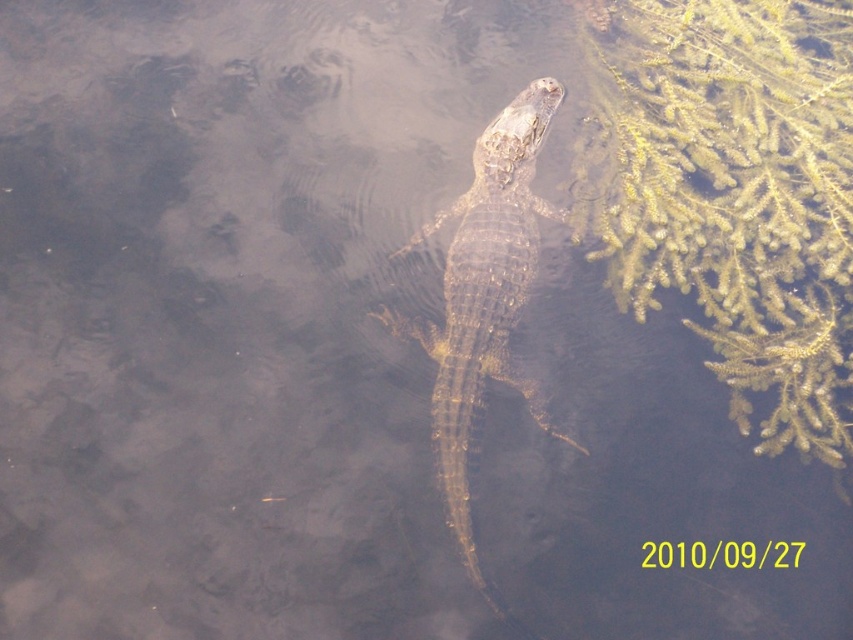
From the picture: Does green mossy plant at right lie in front of shiny brown crocodile at center?

No, green mossy plant at right is further to the viewer.

Describe the element at coordinates (733, 193) in the screenshot. I see `green mossy plant at right` at that location.

Locate an element on the screen. This screenshot has width=853, height=640. green mossy plant at right is located at coordinates (733, 193).